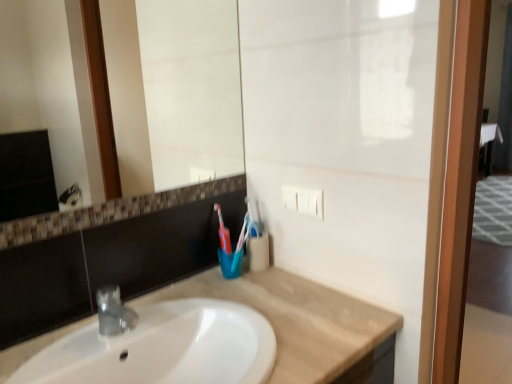
What are the coordinates of `beige marble countertop at center` in the screenshot? It's located at (301, 322).

At what (x,y) coordinates should I click in order to perform the action: click on blue plastic toothbrush at center. Please return your answer as a coordinate pair (x, y). This screenshot has width=512, height=384. Looking at the image, I should click on (252, 219).

Describe the element at coordinates (252, 219) in the screenshot. I see `blue plastic toothbrush at center` at that location.

In order to face white glossy mirror at upper center, should I rotate leftwards or rightwards?

To face it directly, rotate left by 15.141 degrees.

The height and width of the screenshot is (384, 512). In order to click on wooden screen door at right in this screenshot , I will do `click(460, 183)`.

Which is correct: blue plastic toothbrush at center is inside beige marble countertop at center, or outside of it?

The correct answer is: outside.

Is point (250, 234) less distant than point (24, 348)?

That is False.

From the image's perspective, is blue plastic toothbrush at center beneath beige marble countertop at center?

Incorrect, from the image's perspective, blue plastic toothbrush at center is higher than beige marble countertop at center.

Who is shorter, blue plastic toothbrush at center or beige marble countertop at center?

beige marble countertop at center is shorter.

From their relative heights in the image, would you say white glossy mirror at upper center is taller or shorter than blue plastic toothbrush at center?

Considering their sizes, white glossy mirror at upper center has more height than blue plastic toothbrush at center.

Is blue plastic toothbrush at center surrounded by white glossy mirror at upper center?

No, blue plastic toothbrush at center is located outside of white glossy mirror at upper center.

Is point (134, 13) farther from camera compared to point (255, 232)?

Yes, point (134, 13) is farther from viewer.

Could you tell me if white glossy mirror at upper center is turned towards blue plastic toothbrush at center?

No, white glossy mirror at upper center does not turn towards blue plastic toothbrush at center.

Which of these two, blue plastic toothbrush at center or white glossy mirror at upper center, is thinner?

With smaller width is white glossy mirror at upper center.

How distant is blue plastic toothbrush at center from white glossy mirror at upper center?

A distance of 1.20 meters exists between blue plastic toothbrush at center and white glossy mirror at upper center.

Can we say blue plastic toothbrush at center lies outside white glossy mirror at upper center?

blue plastic toothbrush at center lies outside white glossy mirror at upper center's area.

In the scene shown: Could you tell me if blue plastic toothbrush at center is turned towards white glossy mirror at upper center?

No.

Which object is wider, white glossy mirror at upper center or beige marble countertop at center?

beige marble countertop at center is wider.

From a real-world perspective, who is located lower, white glossy mirror at upper center or beige marble countertop at center?

beige marble countertop at center is physically lower.

From the image's perspective, between white glossy mirror at upper center and beige marble countertop at center, which one is located above?

Result: white glossy mirror at upper center, from the image's perspective.

How many degrees apart are the facing directions of white glossy mirror at upper center and beige marble countertop at center?

The angular difference between white glossy mirror at upper center and beige marble countertop at center is 0.0857 degrees.

Is wooden screen door at right positioned with its back to beige marble countertop at center?

No.

The height and width of the screenshot is (384, 512). What are the coordinates of `countertop in front of the wooden screen door at right` in the screenshot? It's located at (301, 322).

Considering the sizes of objects wooden screen door at right and beige marble countertop at center in the image provided, who is taller, wooden screen door at right or beige marble countertop at center?

wooden screen door at right is taller.

How different are the orientations of wooden screen door at right and beige marble countertop at center in degrees?

40.3 degrees.

In terms of size, does blue plastic toothbrush at center appear bigger or smaller than wooden screen door at right?

Clearly, blue plastic toothbrush at center is smaller in size than wooden screen door at right.

Consider the image. Considering the relative sizes of blue plastic toothbrush at center and wooden screen door at right in the image provided, is blue plastic toothbrush at center taller than wooden screen door at right?

No, blue plastic toothbrush at center is not taller than wooden screen door at right.

Considering the positions of objects blue plastic toothbrush at center and wooden screen door at right in the image provided, who is in front, blue plastic toothbrush at center or wooden screen door at right?

wooden screen door at right.

Considering the sizes of objects white glossy mirror at upper center and wooden screen door at right in the image provided, who is wider, white glossy mirror at upper center or wooden screen door at right?

With larger width is wooden screen door at right.

Between white glossy mirror at upper center and wooden screen door at right, which one has smaller size?

white glossy mirror at upper center is smaller.

Can you tell me how much white glossy mirror at upper center and wooden screen door at right differ in facing direction?

white glossy mirror at upper center and wooden screen door at right are facing 40.4 degrees away from each other.

From a real-world perspective, is white glossy mirror at upper center located beneath wooden screen door at right?

No, from a real-world perspective, white glossy mirror at upper center is not under wooden screen door at right.

Locate an element on the screen. toothbrush on the right side of beige marble countertop at center is located at coordinates (252, 219).

You are a GUI agent. You are given a task and a screenshot of the screen. Output one action in this format:
    pyautogui.click(x=<x>, y=<y>)
    Task: Click on the toothbrush below the white glossy mirror at upper center (from the image's perspective)
    The height and width of the screenshot is (384, 512).
    Given the screenshot: What is the action you would take?
    pyautogui.click(x=252, y=219)

Which object lies further to the anchor point white glossy mirror at upper center, beige marble countertop at center or wooden screen door at right?

wooden screen door at right is positioned further to the anchor white glossy mirror at upper center.

Looking at the image, which one is located further to beige marble countertop at center, blue plastic toothbrush at center or white glossy mirror at upper center?

white glossy mirror at upper center lies further to beige marble countertop at center than the other object.

Estimate the real-world distances between objects in this image. Which object is further from wooden screen door at right, white glossy mirror at upper center or blue plastic toothbrush at center?

The object further to wooden screen door at right is white glossy mirror at upper center.

Looking at the image, which one is located further to blue plastic toothbrush at center, beige marble countertop at center or wooden screen door at right?

Based on the image, wooden screen door at right appears to be further to blue plastic toothbrush at center.

Which object lies further to the anchor point blue plastic toothbrush at center, white glossy mirror at upper center or wooden screen door at right?

The object further to blue plastic toothbrush at center is white glossy mirror at upper center.

From the picture: Considering their positions, is white glossy mirror at upper center positioned closer to beige marble countertop at center than wooden screen door at right?

Among the two, wooden screen door at right is located nearer to beige marble countertop at center.

Looking at the image, which one is located closer to wooden screen door at right, blue plastic toothbrush at center or white glossy mirror at upper center?

blue plastic toothbrush at center is closer to wooden screen door at right.

Looking at the image, which one is located closer to white glossy mirror at upper center, blue plastic toothbrush at center or beige marble countertop at center?

beige marble countertop at center is positioned closer to the anchor white glossy mirror at upper center.

You are a GUI agent. You are given a task and a screenshot of the screen. Output one action in this format:
    pyautogui.click(x=<x>, y=<y>)
    Task: Click on the toothbrush located between white glossy mirror at upper center and wooden screen door at right in the left-right direction
    The height and width of the screenshot is (384, 512).
    Given the screenshot: What is the action you would take?
    pyautogui.click(x=252, y=219)

Locate an element on the screen. This screenshot has width=512, height=384. screen door between beige marble countertop at center and blue plastic toothbrush at center from front to back is located at coordinates pyautogui.click(x=460, y=183).

I want to click on countertop between white glossy mirror at upper center and wooden screen door at right from left to right, so click(301, 322).

Locate an element on the screen. Image resolution: width=512 pixels, height=384 pixels. mirror between beige marble countertop at center and blue plastic toothbrush at center along the z-axis is located at coordinates (126, 90).